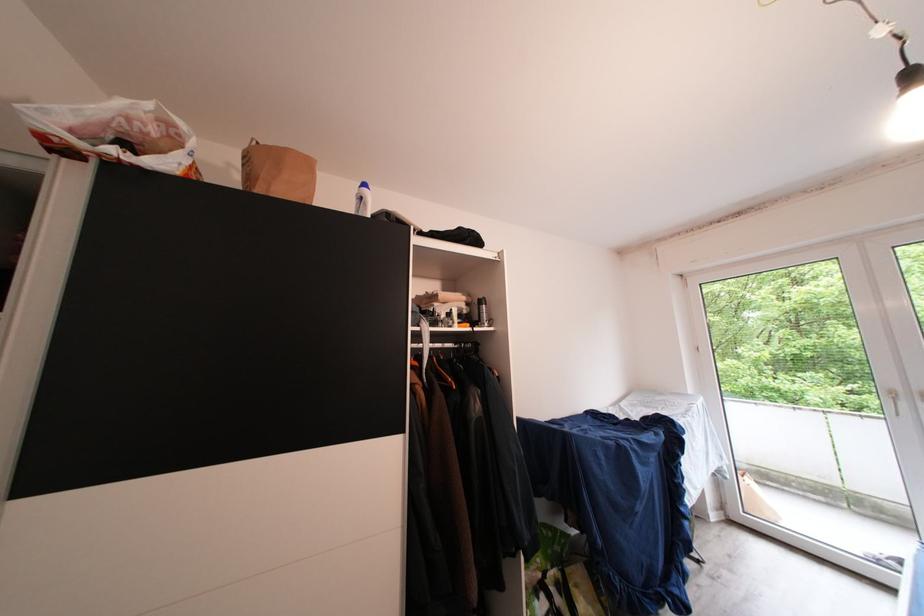
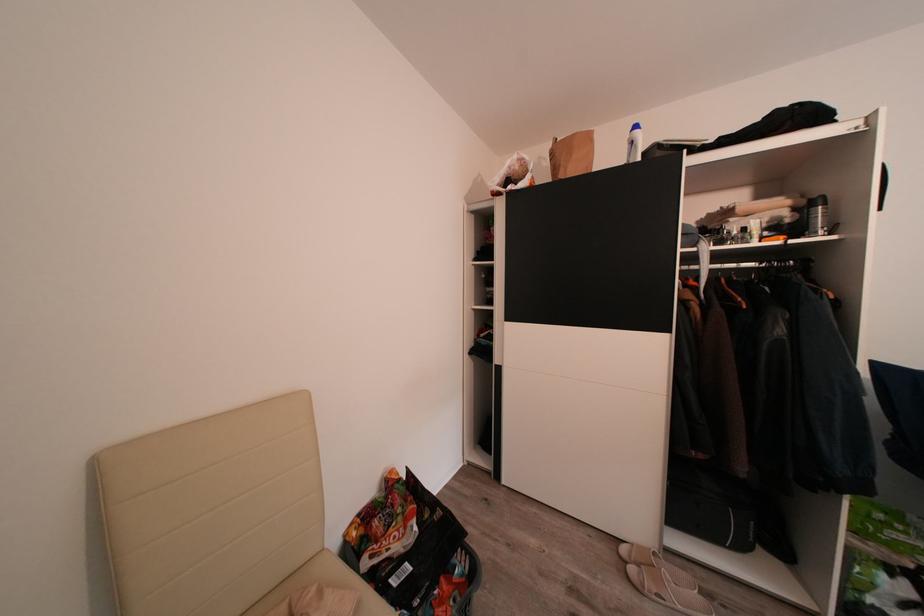
Locate, in the second image, the point that corresponds to point 370,203 in the first image.

(640, 148)